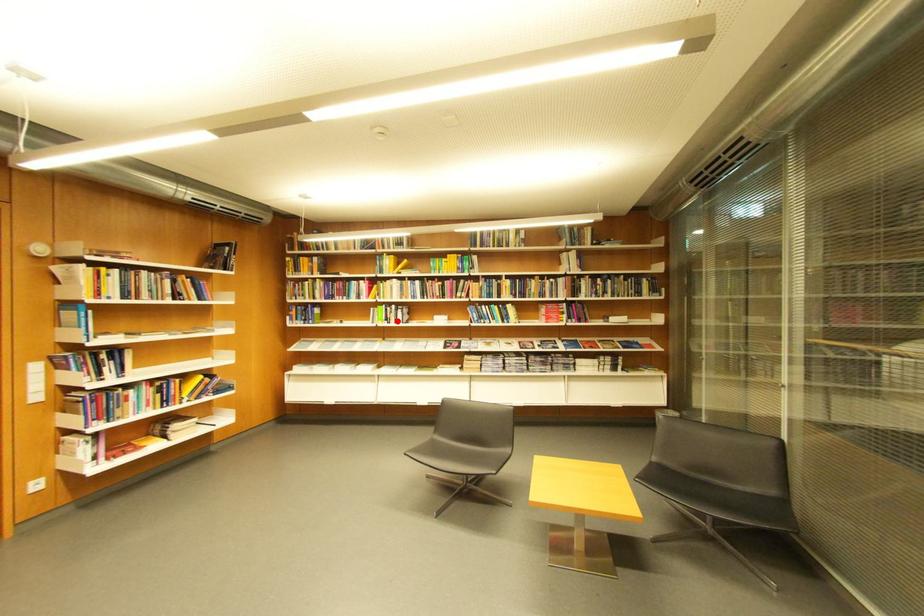
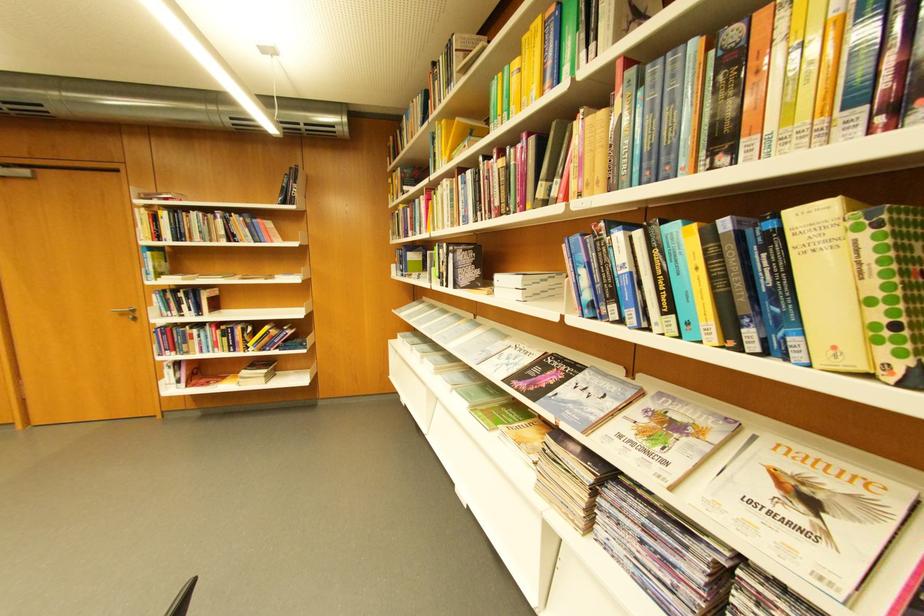
The point at the highlighted location is marked in the first image. Where is the corresponding point in the second image?

(451, 278)